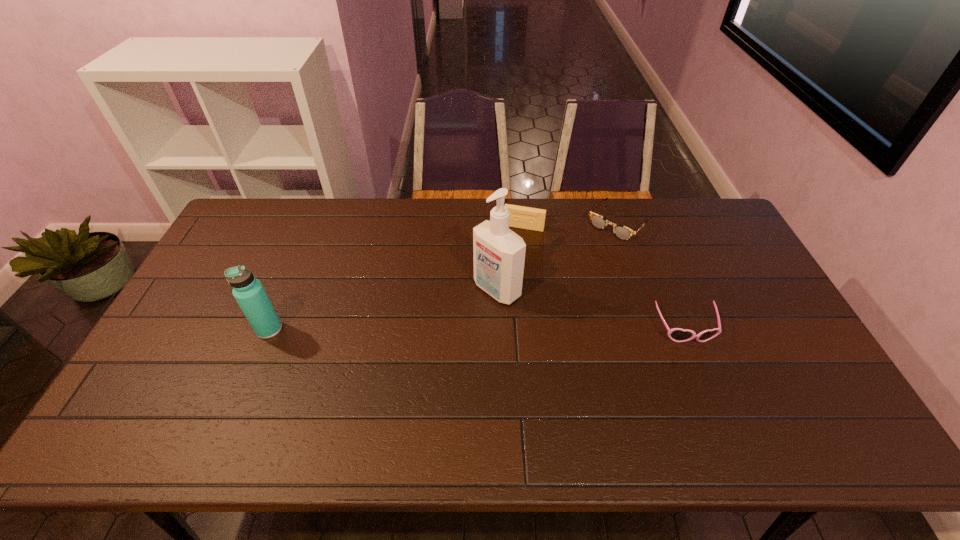
The height and width of the screenshot is (540, 960). I want to click on vacant spot on the desktop that is between the leftmost object and the sunglasses and is positioned at the front of the third tallest object with spools, so coord(493,329).

Find the location of a particular element. This screenshot has width=960, height=540. free space on the desktop that is between the thermos bottle and the sunglasses and is positioned on the frame of the spectacles is located at coordinates (516, 329).

Where is `free spot on the desktop that is between the thermos bottle and the sunglasses and is positioned on the front label of the cleansing agent`? The height and width of the screenshot is (540, 960). free spot on the desktop that is between the thermos bottle and the sunglasses and is positioned on the front label of the cleansing agent is located at coordinates (444, 329).